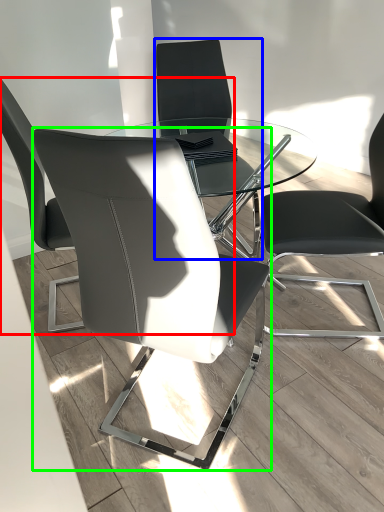
Question: Estimate the real-world distances between objects in this image. Which object is farther from chair (highlighted by a red box), chair (highlighted by a blue box) or chair (highlighted by a green box)?

Choices:
 (A) chair
 (B) chair

Answer: (A)